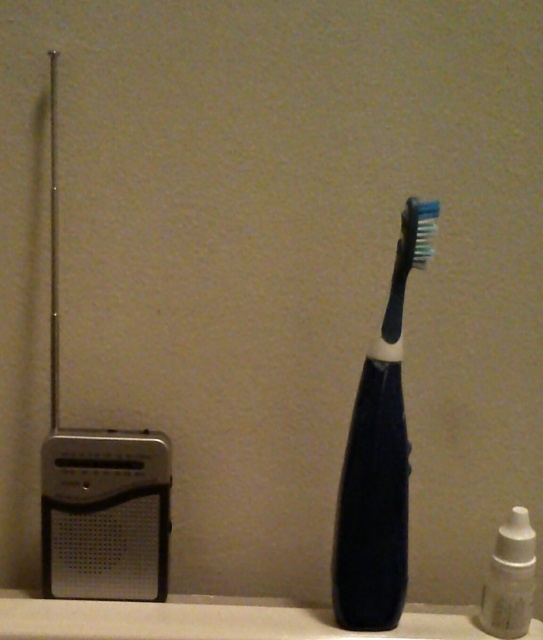
Question: Which of the following is the closest to the observer?

Choices:
 (A) white plastic bottle at lower right
 (B) black rubberized toothbrush at center

Answer: (B)

Question: Which object is farther from the camera taking this photo?

Choices:
 (A) black rubberized toothbrush at center
 (B) white plastic bottle at lower right

Answer: (B)

Question: Which of the following is the farthest from the observer?

Choices:
 (A) black rubberized toothbrush at center
 (B) white plastic bottle at lower right

Answer: (B)

Question: Is black rubberized toothbrush at center below white plastic bottle at lower right?

Choices:
 (A) no
 (B) yes

Answer: (A)

Question: Is black rubberized toothbrush at center smaller than white plastic bottle at lower right?

Choices:
 (A) no
 (B) yes

Answer: (A)

Question: Is black rubberized toothbrush at center further to the viewer compared to white plastic bottle at lower right?

Choices:
 (A) yes
 (B) no

Answer: (B)